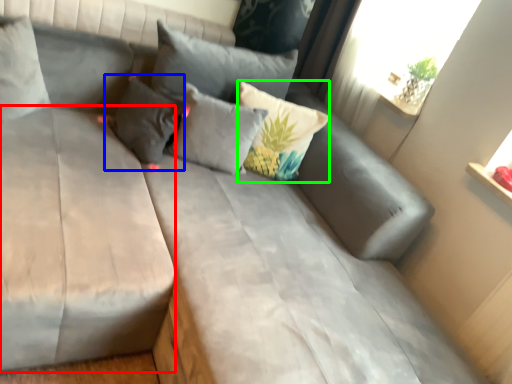
Question: Which object is the closest to the mattress (highlighted by a red box)? Choose among these: pillow (highlighted by a blue box) or pillow (highlighted by a green box).

Choices:
 (A) pillow
 (B) pillow

Answer: (A)